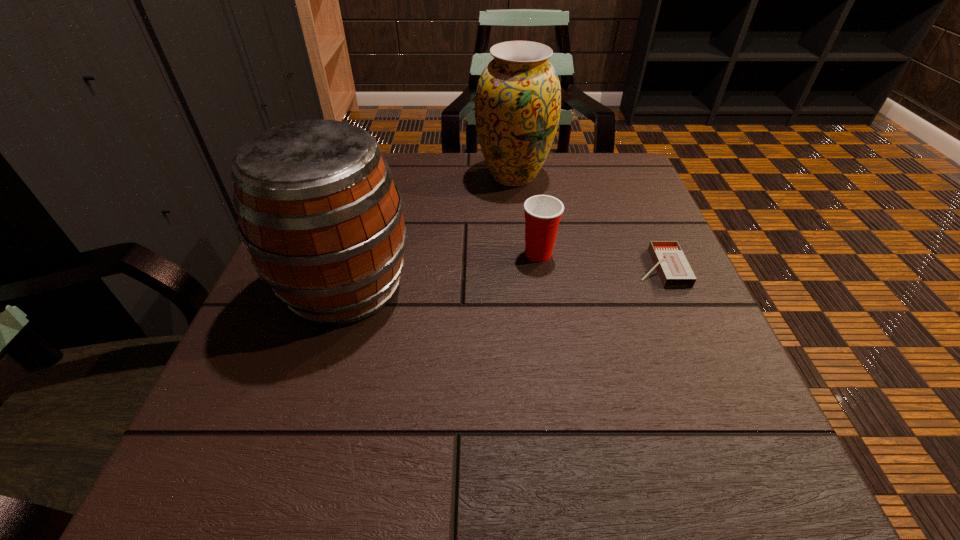
Locate an element on the screen. vacant space positioned on the striking surface of the rightmost object is located at coordinates (555, 268).

The width and height of the screenshot is (960, 540). Identify the location of object located at the far edge. (518, 99).

I want to click on object that is at the left edge, so click(x=318, y=211).

Find the location of `object located in the right edge section of the desktop`. object located in the right edge section of the desktop is located at coordinates [668, 258].

You are a GUI agent. You are given a task and a screenshot of the screen. Output one action in this format:
    pyautogui.click(x=<x>, y=<y>)
    Task: Click on the vacant space at the far edge of the desktop
    Image resolution: width=960 pixels, height=540 pixels.
    Given the screenshot: What is the action you would take?
    pyautogui.click(x=558, y=169)

Image resolution: width=960 pixels, height=540 pixels. What are the coordinates of `free space at the right edge of the desktop` in the screenshot? It's located at click(x=686, y=402).

This screenshot has width=960, height=540. What are the coordinates of `free region at the near left corner` in the screenshot? It's located at (218, 447).

Identify the location of free space at the far right corner of the desktop. (609, 170).

Where is `blank space at the near right corner of the desktop`? This screenshot has width=960, height=540. blank space at the near right corner of the desktop is located at coordinates (667, 455).

I want to click on unoccupied area between the shortest object and the leftmost object, so click(502, 277).